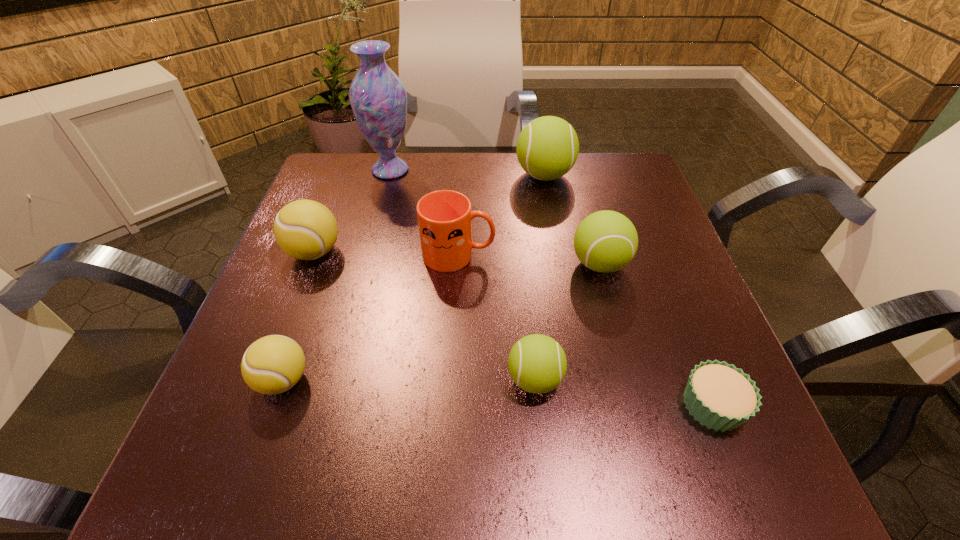
Locate an element on the screen. This screenshot has height=540, width=960. vase that is positioned at the far edge is located at coordinates (378, 98).

Locate an element on the screen. Image resolution: width=960 pixels, height=540 pixels. tennis ball situated at the far edge is located at coordinates (547, 148).

You are a GUI agent. You are given a task and a screenshot of the screen. Output one action in this format:
    pyautogui.click(x=<x>, y=<y>)
    Task: Click on the object that is at the near edge
    
    Given the screenshot: What is the action you would take?
    pyautogui.click(x=720, y=396)

In order to click on vase present at the left edge in this screenshot , I will do `click(378, 98)`.

Find the location of a particular element. The height and width of the screenshot is (540, 960). tennis ball that is at the right edge is located at coordinates (606, 241).

Identify the location of cupcake located at the right edge. (720, 396).

You are a GUI agent. You are given a task and a screenshot of the screen. Output one action in this format:
    pyautogui.click(x=<x>, y=<y>)
    Task: Click on the object that is at the far left corner
    Image resolution: width=960 pixels, height=540 pixels.
    Given the screenshot: What is the action you would take?
    pyautogui.click(x=378, y=98)

You are a GUI agent. You are given a task and a screenshot of the screen. Output one action in this format:
    pyautogui.click(x=<x>, y=<y>)
    Task: Click on the object located in the near right corner section of the desktop
    The image size is (960, 540).
    Given the screenshot: What is the action you would take?
    pyautogui.click(x=720, y=396)

In order to click on blank space at the far edge of the desktop in this screenshot , I will do `click(444, 170)`.

You are a GUI agent. You are given a task and a screenshot of the screen. Output one action in this format:
    pyautogui.click(x=<x>, y=<y>)
    Task: Click on the free space at the near edge of the desktop
    Image resolution: width=960 pixels, height=540 pixels.
    Given the screenshot: What is the action you would take?
    pyautogui.click(x=588, y=450)